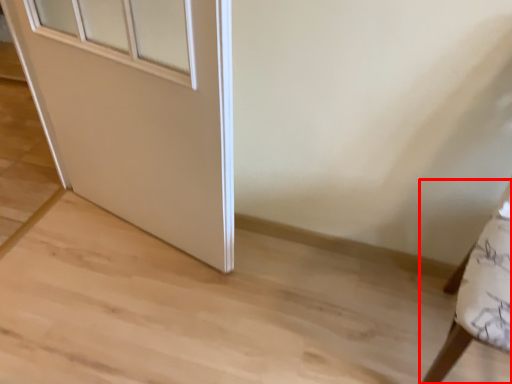
Question: From the image's perspective, where is furniture (annotated by the red box) located in relation to door in the image?

Choices:
 (A) below
 (B) above

Answer: (A)